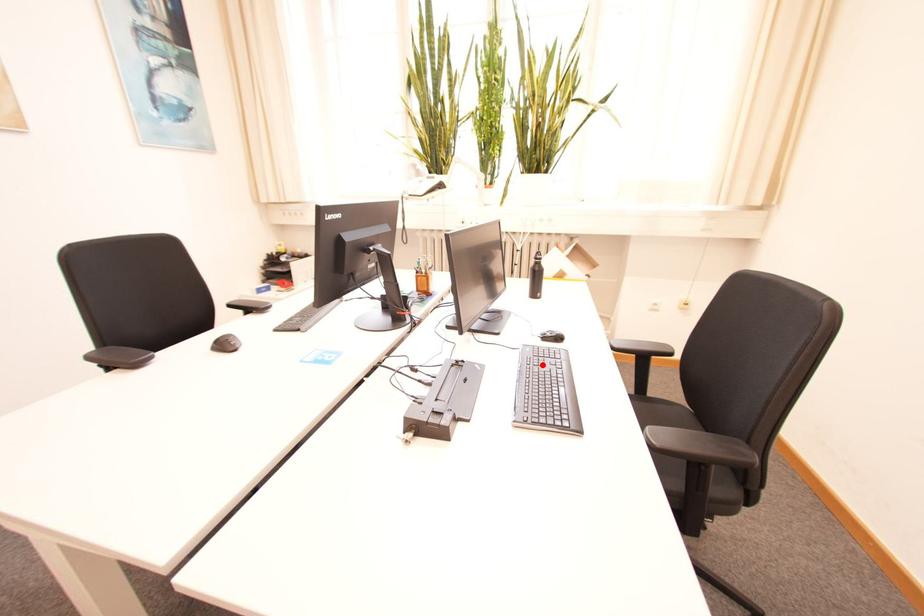
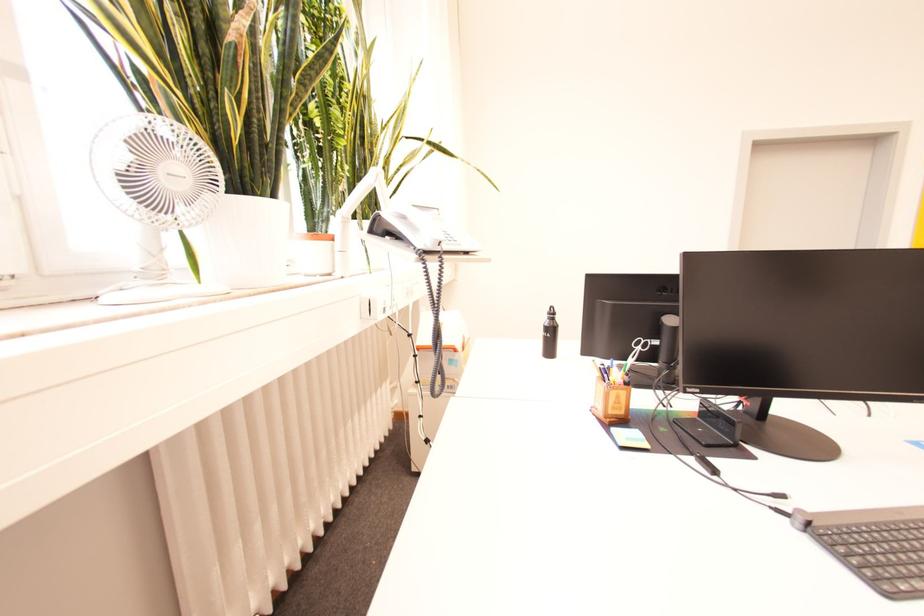
Question: I am providing you with two images of the same scene from different viewpoints. A red point is marked on the first image. Can you still see the location of the red point in image 2?

Choices:
 (A) Yes
 (B) No

Answer: (B)